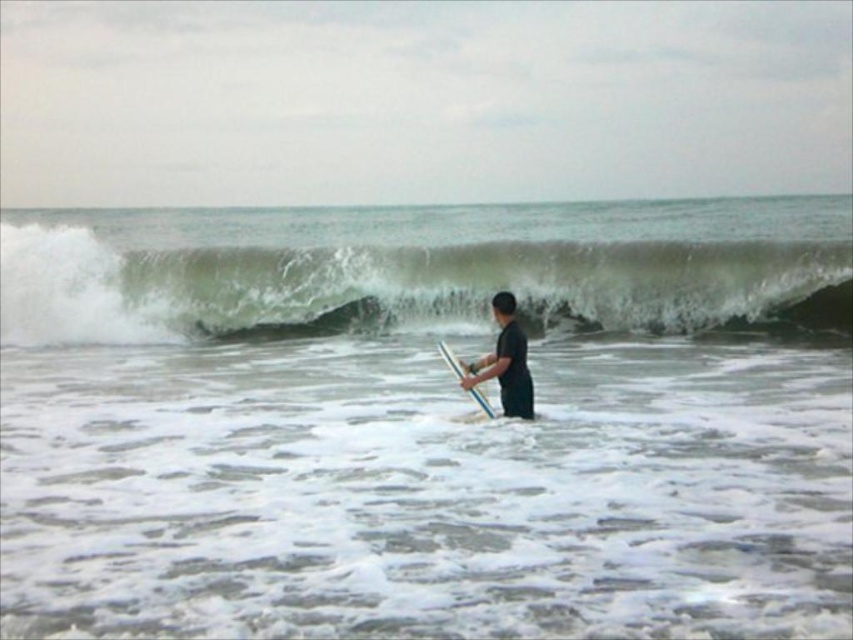
Question: Is dark gray matte surfboard at center below white plastic surfboard at center?

Choices:
 (A) yes
 (B) no

Answer: (B)

Question: Which point is farther from the camera taking this photo?

Choices:
 (A) (515, 355)
 (B) (234, 474)

Answer: (A)

Question: Is white frothy wave at upper center behind dark gray matte surfboard at center?

Choices:
 (A) no
 (B) yes

Answer: (B)

Question: Which object is closer to the camera taking this photo?

Choices:
 (A) white frothy wave at upper center
 (B) dark gray matte surfboard at center
 (C) white frothy water at center
 (D) white plastic surfboard at center

Answer: (C)

Question: Is white frothy wave at upper center below white plastic surfboard at center?

Choices:
 (A) no
 (B) yes

Answer: (A)

Question: Which object is closer to the camera taking this photo?

Choices:
 (A) white frothy water at center
 (B) white plastic surfboard at center
 (C) dark gray matte surfboard at center

Answer: (A)